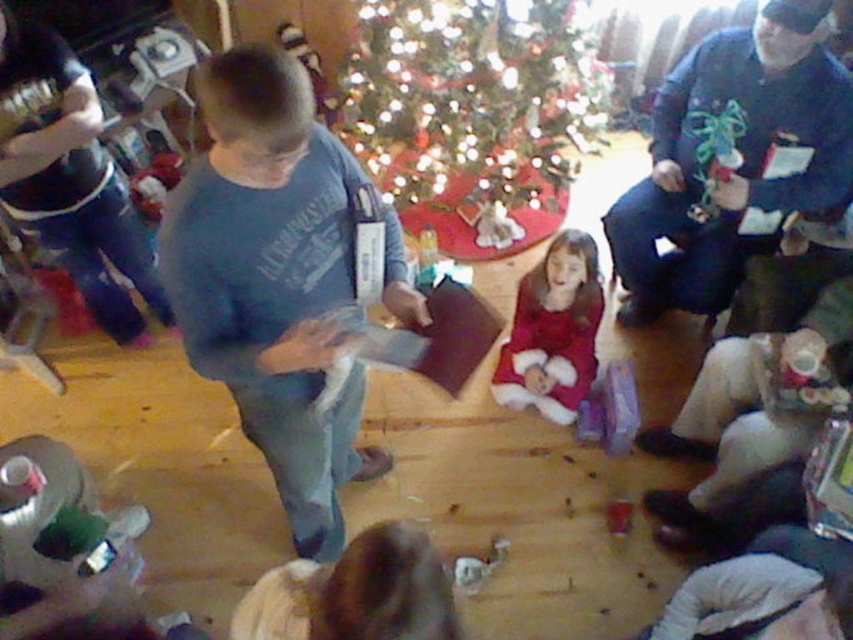
Question: Based on their relative distances, which object is farther from the blue fleece sweater at center?

Choices:
 (A) blue cotton shirt at center
 (B) velvet red dress at center

Answer: (A)

Question: Among these points, which one is nearest to the camera?

Choices:
 (A) (352, 97)
 (B) (660, 198)

Answer: (B)

Question: Is the position of blue cotton shirt at center less distant than that of blue fleece sweater at center?

Choices:
 (A) yes
 (B) no

Answer: (A)

Question: Is blue cotton shirt at center closer to camera compared to shiny metallic tree at center?

Choices:
 (A) yes
 (B) no

Answer: (A)

Question: Which point is closer to the camera?

Choices:
 (A) shiny metallic tree at center
 (B) blue fleece sweater at center
 (C) blue cotton shirt at center
 (D) velvet red dress at center

Answer: (C)

Question: Does blue fleece sweater at center appear on the right side of velvet red dress at center?

Choices:
 (A) no
 (B) yes

Answer: (B)